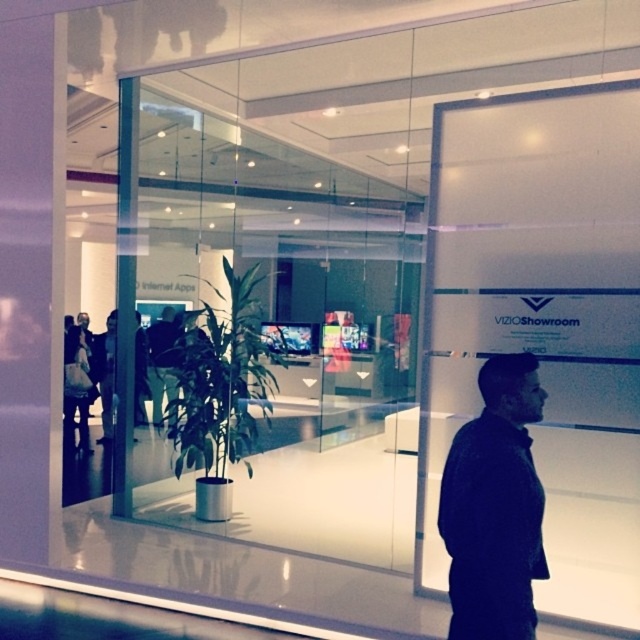
Question: From the image, what is the correct spatial relationship of dark blue fabric at center in relation to green leafy plant at center?

Choices:
 (A) right
 (B) left

Answer: (A)

Question: Which point is closer to the camera?

Choices:
 (A) black leather jacket at center
 (B) transparent glass door at center
 (C) dark blue fabric at center
 (D) green leafy plant at center

Answer: (C)

Question: Can you confirm if transparent glass door at center is smaller than dark blue fabric at center?

Choices:
 (A) no
 (B) yes

Answer: (A)

Question: Does transparent glass door at center lie behind green leafy plant at center?

Choices:
 (A) no
 (B) yes

Answer: (A)

Question: Which of the following is the closest to the observer?

Choices:
 (A) (472, 554)
 (B) (202, 436)
 (C) (166, 388)

Answer: (A)

Question: Which point appears farthest from the camera in this image?

Choices:
 (A) (513, 538)
 (B) (220, 337)
 (C) (157, 323)

Answer: (C)